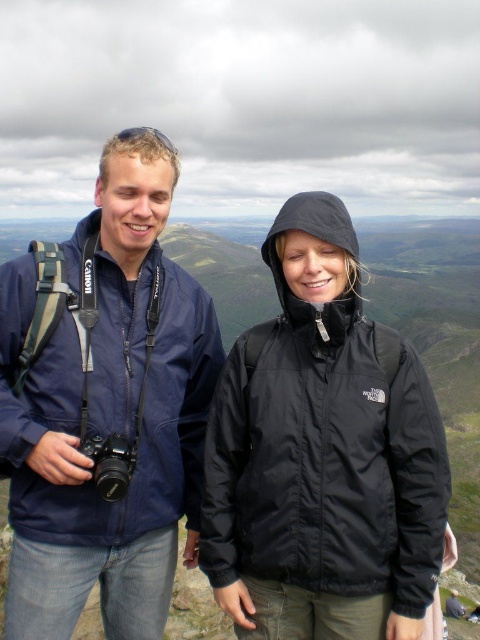
Between matte blue jacket at left and black/waterproof jacket at center, which one is positioned lower?

Result: matte blue jacket at left is below.

Which is above, matte blue jacket at left or black/waterproof jacket at center?

black/waterproof jacket at center is above.

What do you see at coordinates (104, 406) in the screenshot?
I see `matte blue jacket at left` at bounding box center [104, 406].

Identify the location of matte blue jacket at left. (104, 406).